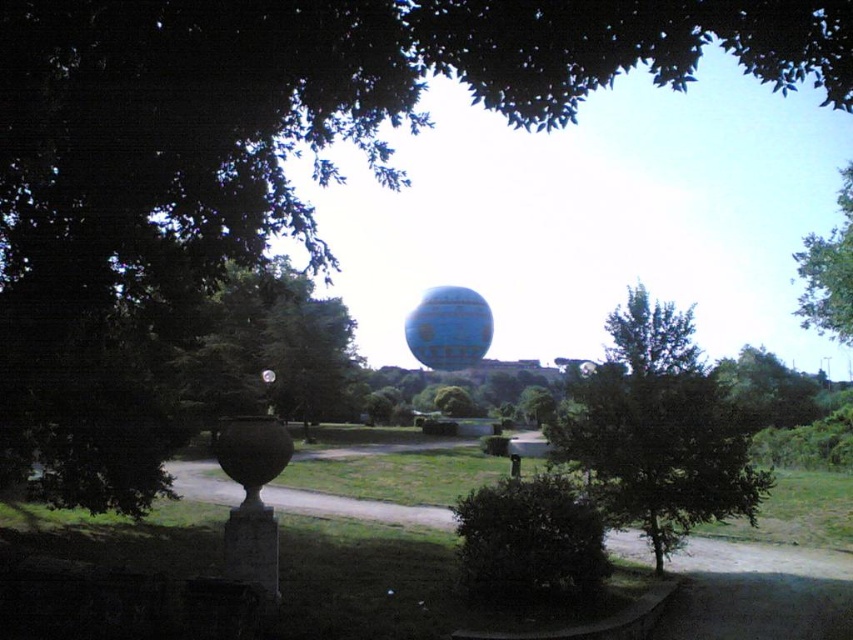
Question: Can you confirm if green leafy tree at center is positioned to the right of blue rubber balloon at center?

Choices:
 (A) no
 (B) yes

Answer: (B)

Question: Can you confirm if green leafy tree at upper right is positioned to the left of blue rubber balloon at center?

Choices:
 (A) no
 (B) yes

Answer: (A)

Question: In this image, where is green leafy tree at left located relative to green leafy tree at upper right?

Choices:
 (A) below
 (B) above

Answer: (A)

Question: Which of these objects is positioned farthest from the green leafy tree at upper right?

Choices:
 (A) green leafy tree at left
 (B) green leafy tree at center

Answer: (B)

Question: Which object appears closest to the camera in this image?

Choices:
 (A) blue rubber balloon at center
 (B) green leafy tree at upper right
 (C) green leafy tree at left

Answer: (C)

Question: Among these points, which one is nearest to the camera?

Choices:
 (A) (659, 561)
 (B) (177, 380)
 (C) (463, 292)

Answer: (A)